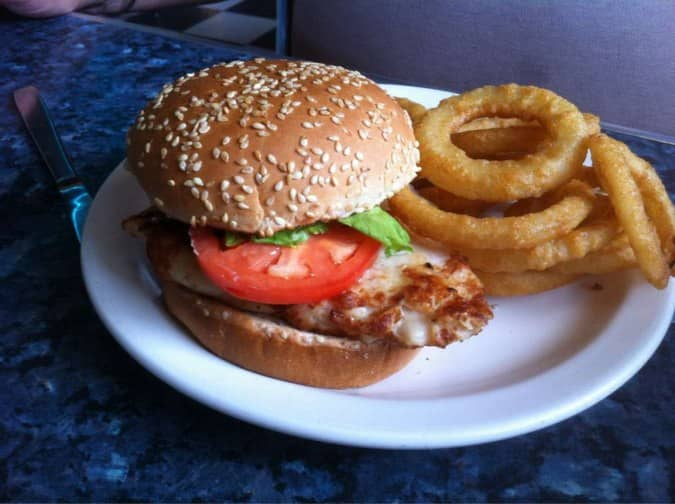
This screenshot has width=675, height=504. What are the coordinates of `knife handle` in the screenshot? It's located at (50, 152).